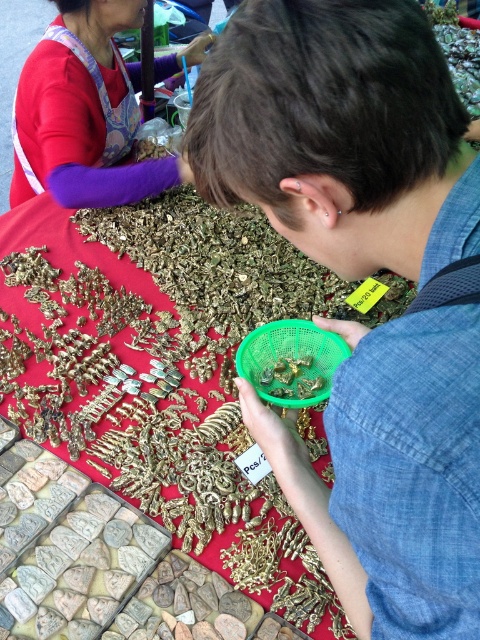
Question: Which point is farther to the camera?

Choices:
 (A) matte red shirt at upper left
 (B) gold metallic jewelry at center

Answer: (A)

Question: Does gold metallic jewelry at center come behind matte red shirt at upper left?

Choices:
 (A) no
 (B) yes

Answer: (A)

Question: Which of the following is the closest to the observer?

Choices:
 (A) (117, 118)
 (B) (179, 301)

Answer: (B)

Question: Can you confirm if gold metallic jewelry at center is wider than matte red shirt at upper left?

Choices:
 (A) yes
 (B) no

Answer: (A)

Question: Does gold metallic jewelry at center appear on the left side of matte red shirt at upper left?

Choices:
 (A) no
 (B) yes

Answer: (A)

Question: Which point appears closest to the camera in this image?

Choices:
 (A) (57, 106)
 (B) (186, 364)
 (C) (257, 134)

Answer: (C)